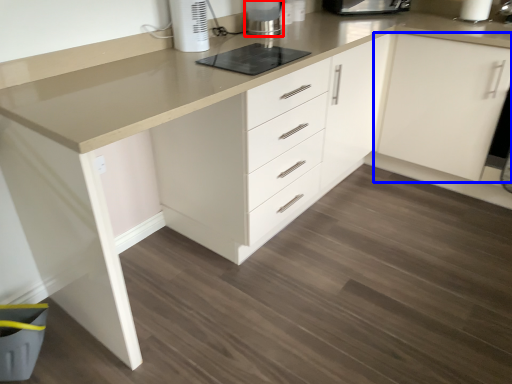
Question: Which of the following is the farthest to the observer, home appliance (highlighted by a red box) or cabinetry (highlighted by a blue box)?

Choices:
 (A) home appliance
 (B) cabinetry

Answer: (A)